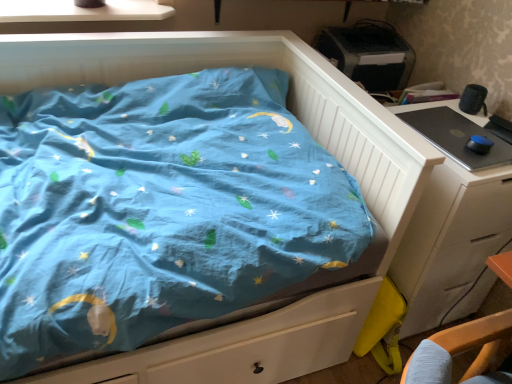
Question: Does white glossy window sill at upper left have a lesser width compared to black glossy desktop at right?

Choices:
 (A) no
 (B) yes

Answer: (A)

Question: From the image's perspective, does white glossy window sill at upper left appear lower than black glossy desktop at right?

Choices:
 (A) yes
 (B) no

Answer: (B)

Question: Does white glossy window sill at upper left touch black glossy desktop at right?

Choices:
 (A) yes
 (B) no

Answer: (B)

Question: Is white glossy window sill at upper left looking in the opposite direction of black glossy desktop at right?

Choices:
 (A) yes
 (B) no

Answer: (B)

Question: Considering the relative positions of white glossy window sill at upper left and black glossy desktop at right in the image provided, is white glossy window sill at upper left to the right of black glossy desktop at right from the viewer's perspective?

Choices:
 (A) yes
 (B) no

Answer: (B)

Question: From the image's perspective, is white glossy window sill at upper left above or below white wood chest of drawers at right?

Choices:
 (A) below
 (B) above

Answer: (B)

Question: Considering the positions of point (2, 21) and point (411, 319), is point (2, 21) closer or farther from the camera than point (411, 319)?

Choices:
 (A) closer
 (B) farther

Answer: (A)

Question: Is white glossy window sill at upper left wider or thinner than white wood chest of drawers at right?

Choices:
 (A) thin
 (B) wide

Answer: (A)

Question: Looking at the image, does white glossy window sill at upper left seem bigger or smaller compared to white wood chest of drawers at right?

Choices:
 (A) big
 (B) small

Answer: (B)

Question: Is white wood chest of drawers at right inside the boundaries of black glossy desktop at right, or outside?

Choices:
 (A) inside
 (B) outside

Answer: (B)

Question: From a real-world perspective, is white wood chest of drawers at right above or below black glossy desktop at right?

Choices:
 (A) below
 (B) above

Answer: (A)

Question: In terms of size, does white wood chest of drawers at right appear bigger or smaller than black glossy desktop at right?

Choices:
 (A) small
 (B) big

Answer: (B)

Question: Considering their positions, is white wood chest of drawers at right located in front of or behind black glossy desktop at right?

Choices:
 (A) behind
 (B) front

Answer: (B)

Question: Is white glossy window sill at upper left in front of or behind black glossy desktop at right in the image?

Choices:
 (A) front
 (B) behind

Answer: (B)

Question: From a real-world perspective, is white glossy window sill at upper left above or below black glossy desktop at right?

Choices:
 (A) below
 (B) above

Answer: (B)